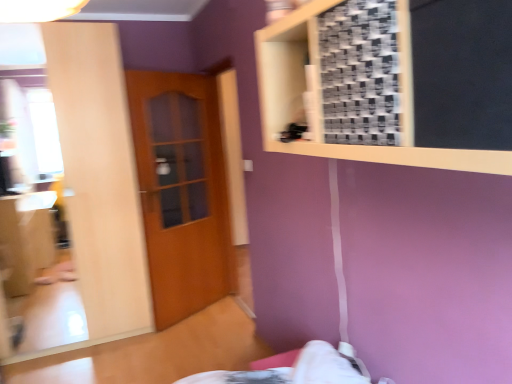
Question: Is wooden door at center further to camera compared to wooden frame at upper right?

Choices:
 (A) no
 (B) yes

Answer: (B)

Question: Does wooden door at center have a smaller size compared to wooden frame at upper right?

Choices:
 (A) no
 (B) yes

Answer: (B)

Question: Can you confirm if wooden door at center is shorter than wooden frame at upper right?

Choices:
 (A) no
 (B) yes

Answer: (A)

Question: Can you confirm if wooden door at center is wider than wooden frame at upper right?

Choices:
 (A) no
 (B) yes

Answer: (A)

Question: Could you tell me if wooden door at center is facing wooden frame at upper right?

Choices:
 (A) yes
 (B) no

Answer: (B)

Question: Which is correct: wooden frame at upper right is inside matte wooden mirror at left, or outside of it?

Choices:
 (A) outside
 (B) inside

Answer: (A)

Question: Relative to matte wooden mirror at left, is wooden frame at upper right in front or behind?

Choices:
 (A) front
 (B) behind

Answer: (A)

Question: Looking at their shapes, would you say wooden frame at upper right is wider or thinner than matte wooden mirror at left?

Choices:
 (A) wide
 (B) thin

Answer: (B)

Question: Considering the positions of wooden frame at upper right and matte wooden mirror at left in the image, is wooden frame at upper right taller or shorter than matte wooden mirror at left?

Choices:
 (A) short
 (B) tall

Answer: (A)

Question: In terms of height, does wooden frame at upper right look taller or shorter compared to wooden door at center?

Choices:
 (A) tall
 (B) short

Answer: (B)

Question: Considering the positions of point (278, 56) and point (176, 89), is point (278, 56) closer or farther from the camera than point (176, 89)?

Choices:
 (A) closer
 (B) farther

Answer: (A)

Question: Choose the correct answer: Is wooden frame at upper right inside wooden door at center or outside it?

Choices:
 (A) outside
 (B) inside

Answer: (A)

Question: From the image's perspective, is wooden frame at upper right positioned above or below wooden door at center?

Choices:
 (A) above
 (B) below

Answer: (A)

Question: From the image's perspective, is wooden door at center positioned above or below wooden frame at upper right?

Choices:
 (A) below
 (B) above

Answer: (A)

Question: In terms of width, does wooden door at center look wider or thinner when compared to wooden frame at upper right?

Choices:
 (A) thin
 (B) wide

Answer: (A)